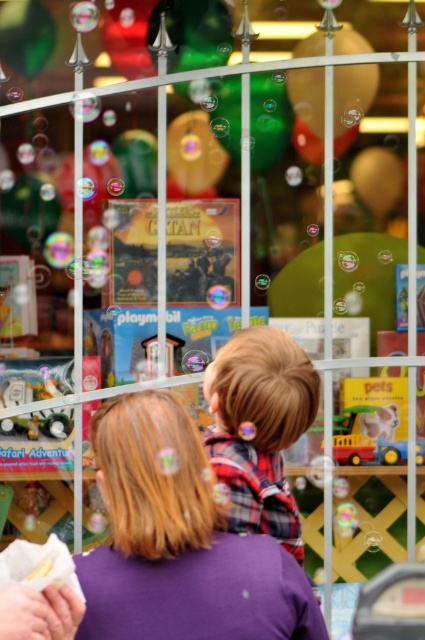
Is purple fabric at center smaller than green matte balloon at upper center?

No.

Does purple fabric at center have a lesser width compared to green matte balloon at upper center?

No.

Who is more forward, (x=186, y=529) or (x=351, y=44)?

Point (x=186, y=529)

What are the coordinates of `purple fabric at center` in the screenshot? It's located at (178, 541).

Which is above, purple fabric at center or metallic silver watch at left?

Positioned higher is metallic silver watch at left.

Is point (189, 497) behind point (11, 400)?

No, it is not.

The height and width of the screenshot is (640, 425). I want to click on purple fabric at center, so click(178, 541).

Can you confirm if green matte balloon at upper center is positioned to the left of metallic silver watch at left?

No, green matte balloon at upper center is not to the left of metallic silver watch at left.

Is point (294, 109) positioned behind point (54, 428)?

That is True.

Find the location of a particular element. green matte balloon at upper center is located at coordinates (353, 93).